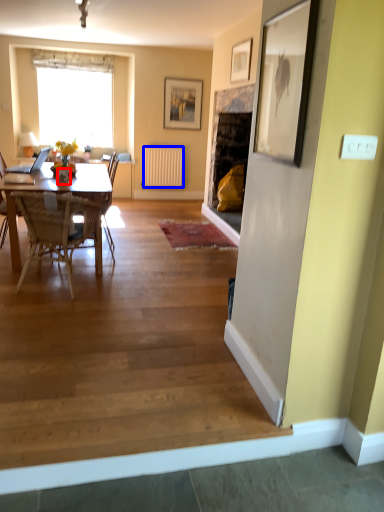
Question: Which of the following is the farthest to the observer, vase (highlighted by a red box) or radiator (highlighted by a blue box)?

Choices:
 (A) vase
 (B) radiator

Answer: (B)